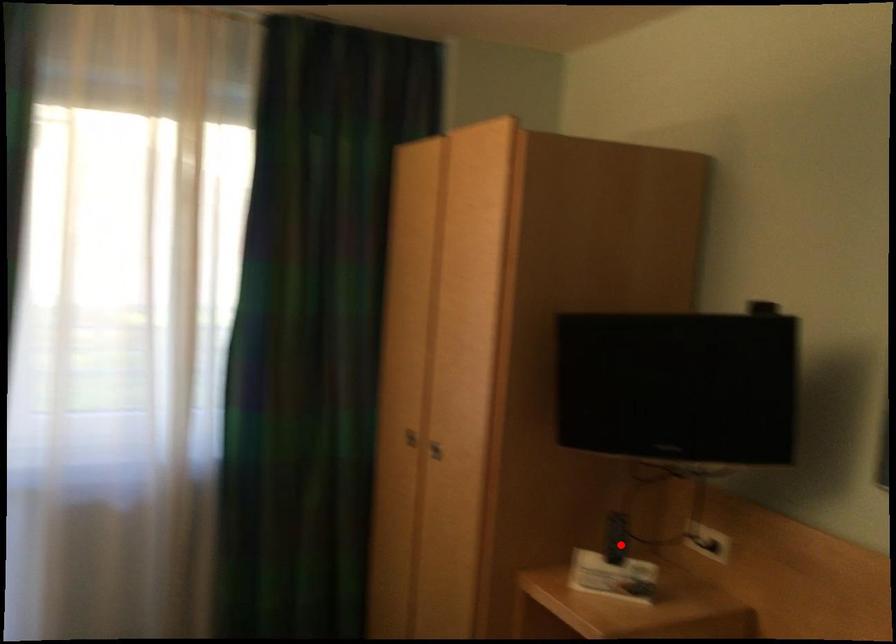
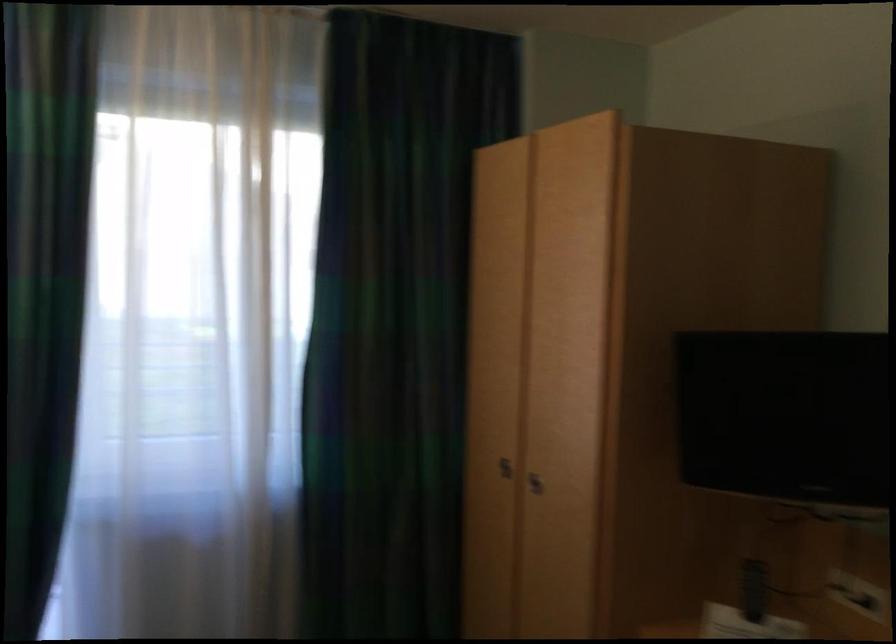
Find the pixel in the second image that matches the highlighted location in the first image.

(754, 589)